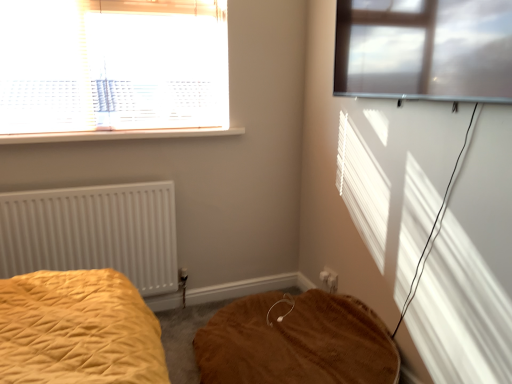
Measure the distance between point (333, 277) and camera.

Point (333, 277) and camera are 8.19 feet apart from each other.

Describe the element at coordinates (296, 342) in the screenshot. The width and height of the screenshot is (512, 384). I see `brown plush mattress at lower center` at that location.

Consider the image. Measure the distance between point (426, 79) and camera.

Point (426, 79) is 5.21 feet away from camera.

Image resolution: width=512 pixels, height=384 pixels. I want to click on white matte radiator at left, so click(93, 232).

At what (x,y) coordinates should I click in order to perform the action: click on window sill on the left of white plastic electric outlet at lower center. Please return your answer as a coordinate pair (x, y). The height and width of the screenshot is (384, 512). Looking at the image, I should click on (118, 135).

Which is in front, point (193, 131) or point (333, 286)?

Positioned in front is point (193, 131).

Is white plastic window sill at upper left oriented towards white plastic electric outlet at lower center?

No, white plastic window sill at upper left is not oriented towards white plastic electric outlet at lower center.

From a real-world perspective, relative to white plastic electric outlet at lower center, is white plastic window sill at upper left vertically above or below?

white plastic window sill at upper left is situated higher than white plastic electric outlet at lower center in the real world.

Locate an element on the screen. The width and height of the screenshot is (512, 384). mattress in front of the white plastic window sill at upper left is located at coordinates (296, 342).

Is brown plush mattress at lower center aimed at white plastic window sill at upper left?

No, brown plush mattress at lower center is not facing towards white plastic window sill at upper left.

How different are the orientations of brown plush mattress at lower center and white plastic window sill at upper left in degrees?

89.9 degrees.

Consider the image. How much distance is there between brown plush mattress at lower center and white plastic window sill at upper left?

brown plush mattress at lower center and white plastic window sill at upper left are 1.22 meters apart from each other.

Considering their positions, is white matte radiator at left located in front of or behind transparent glass window at upper right, placed as the 2th window when sorted from back to front?

In the image, white matte radiator at left appears behind transparent glass window at upper right, placed as the 2th window when sorted from back to front.

Is white matte radiator at left in contact with transparent glass window at upper right, acting as the first window starting from the right?

No.

From a real-world perspective, is white matte radiator at left positioned above or below transparent glass window at upper right, the 1th window from the front?

From a real-world perspective, white matte radiator at left is physically below transparent glass window at upper right, the 1th window from the front.

What's the angular difference between white matte radiator at left and transparent glass window at upper right, placed as the 2th window when sorted from back to front,'s facing directions?

They differ by 91.3 degrees in their facing directions.

Image resolution: width=512 pixels, height=384 pixels. Identify the location of window sill on the right of white plastic window at upper left, the first window when ordered from left to right. (118, 135).

From a real-world perspective, does white plastic window sill at upper left stand above white plastic window at upper left, positioned as the 2th window in right-to-left order?

No, from a real-world perspective, white plastic window sill at upper left is not on top of white plastic window at upper left, positioned as the 2th window in right-to-left order.

Considering the points (3, 144) and (192, 51), which point is in front, point (3, 144) or point (192, 51)?

The point (3, 144) is more forward.

Could you tell me if white plastic window sill at upper left is facing white plastic window at upper left, positioned as the 2th window in right-to-left order?

No, white plastic window sill at upper left is not facing towards white plastic window at upper left, positioned as the 2th window in right-to-left order.

Visually, is white plastic electric outlet at lower center positioned to the left or to the right of brown plush mattress at lower center?

white plastic electric outlet at lower center is positioned on brown plush mattress at lower center's right side.

Could brown plush mattress at lower center be considered to be inside white plastic electric outlet at lower center?

No, white plastic electric outlet at lower center does not contain brown plush mattress at lower center.

From a real-world perspective, is white plastic electric outlet at lower center physically located above or below brown plush mattress at lower center?

white plastic electric outlet at lower center is situated higher than brown plush mattress at lower center in the real world.

How different are the orientations of white plastic window at upper left, the second window viewed from the front, and white plastic window sill at upper left in degrees?

0.228 degrees separate the facing orientations of white plastic window at upper left, the second window viewed from the front, and white plastic window sill at upper left.

Which object is positioned more to the left, white plastic window at upper left, the first window when ordered from left to right, or white plastic window sill at upper left?

Positioned to the left is white plastic window at upper left, the first window when ordered from left to right.

Between point (192, 21) and point (21, 135), which one is positioned behind?

The point (192, 21) is farther.

Is white plastic window at upper left, the second window viewed from the front, turned away from white plastic window sill at upper left?

No, white plastic window sill at upper left is not at the back of white plastic window at upper left, the second window viewed from the front.

Is white plastic window sill at upper left with brown plush mattress at lower center?

No, white plastic window sill at upper left is not beside brown plush mattress at lower center.

Is white plastic window sill at upper left to the right of brown plush mattress at lower center from the viewer's perspective?

No, white plastic window sill at upper left is not to the right of brown plush mattress at lower center.

Is white plastic window sill at upper left thinner than brown plush mattress at lower center?

Correct, the width of white plastic window sill at upper left is less than that of brown plush mattress at lower center.

Who is smaller, white plastic window sill at upper left or brown plush mattress at lower center?

white plastic window sill at upper left.

Find the location of `window sill in front of the white plastic electric outlet at lower center`. window sill in front of the white plastic electric outlet at lower center is located at coordinates (118, 135).

Where is `window sill behind the brown plush mattress at lower center`? The width and height of the screenshot is (512, 384). window sill behind the brown plush mattress at lower center is located at coordinates (118, 135).

Which object lies nearer to the anchor point transparent glass window at upper right, the 1th window from the front, white plastic window sill at upper left or brown plush mattress at lower center?

white plastic window sill at upper left.

Based on their spatial positions, is white plastic window at upper left, the second window viewed from the front, or white matte radiator at left closer to brown plush mattress at lower center?

white matte radiator at left lies closer to brown plush mattress at lower center than the other object.

Based on their spatial positions, is white plastic window sill at upper left or brown plush mattress at lower center closer to white matte radiator at left?

white plastic window sill at upper left lies closer to white matte radiator at left than the other object.

Based on their spatial positions, is white plastic electric outlet at lower center or white matte radiator at left closer to transparent glass window at upper right, the 1th window from the front?

white plastic electric outlet at lower center is closer to transparent glass window at upper right, the 1th window from the front.

From the image, which object appears to be farther from white plastic window sill at upper left, white matte radiator at left or white plastic window at upper left, placed as the first window when sorted from back to front?

The object further to white plastic window sill at upper left is white matte radiator at left.

Based on their spatial positions, is white plastic electric outlet at lower center or white plastic window sill at upper left closer to white matte radiator at left?

white plastic window sill at upper left is positioned closer to the anchor white matte radiator at left.

Estimate the real-world distances between objects in this image. Which object is closer to white plastic electric outlet at lower center, white matte radiator at left or transparent glass window at upper right, arranged as the second window when viewed from the left?

white matte radiator at left is positioned closer to the anchor white plastic electric outlet at lower center.

Looking at the image, which one is located further to brown plush mattress at lower center, white matte radiator at left or white plastic electric outlet at lower center?

The object further to brown plush mattress at lower center is white matte radiator at left.

Locate an element on the screen. electric outlet between white plastic window at upper left, the first window when ordered from left to right, and transparent glass window at upper right, placed as the 2th window when sorted from back to front, in the horizontal direction is located at coordinates (329, 279).

Identify the location of mattress between white plastic window sill at upper left and white plastic electric outlet at lower center in the horizontal direction. The image size is (512, 384). (296, 342).

At what (x,y) coordinates should I click in order to perform the action: click on window situated between white matte radiator at left and white plastic electric outlet at lower center from left to right. Please return your answer as a coordinate pair (x, y). The width and height of the screenshot is (512, 384). Looking at the image, I should click on (113, 70).

At what (x,y) coordinates should I click in order to perform the action: click on electric outlet that lies between white plastic window at upper left, the first window when ordered from left to right, and brown plush mattress at lower center from top to bottom. Please return your answer as a coordinate pair (x, y). Looking at the image, I should click on (329, 279).